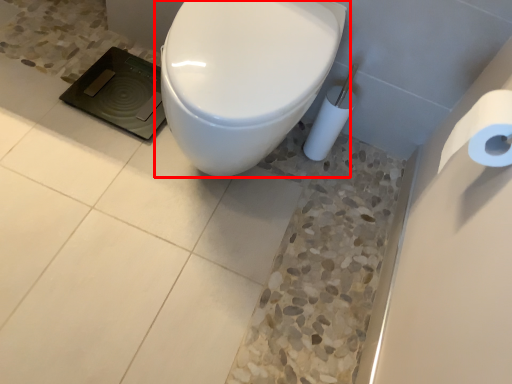
Question: From the image's perspective, where is toilet (annotated by the red box) located relative to toilet paper?

Choices:
 (A) below
 (B) above

Answer: (B)